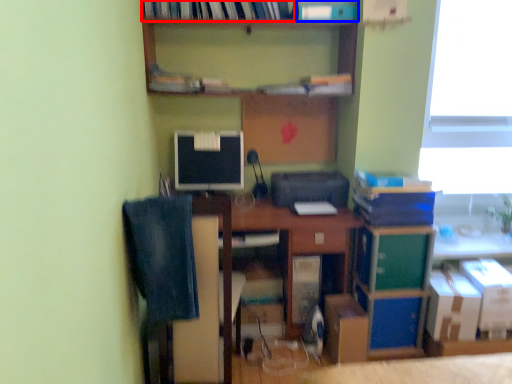
Question: Which point is closer to the camera, book (highlighted by a red box) or book (highlighted by a blue box)?

Choices:
 (A) book
 (B) book

Answer: (A)